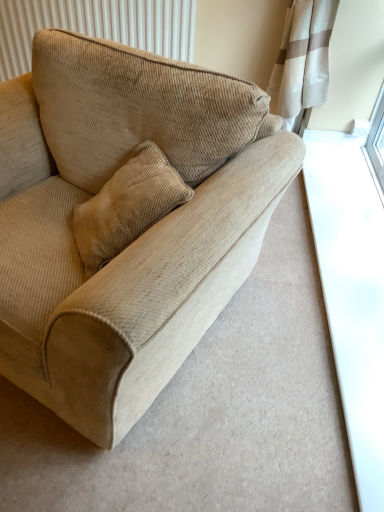
Question: Is beige corduroy radiator at upper left a part of beige corduroy couch at center?

Choices:
 (A) no
 (B) yes

Answer: (A)

Question: Can you confirm if beige corduroy couch at center is wider than beige corduroy radiator at upper left?

Choices:
 (A) yes
 (B) no

Answer: (A)

Question: Does beige corduroy couch at center have a smaller size compared to beige corduroy radiator at upper left?

Choices:
 (A) no
 (B) yes

Answer: (A)

Question: Is there a large distance between beige corduroy couch at center and beige corduroy radiator at upper left?

Choices:
 (A) yes
 (B) no

Answer: (A)

Question: From a real-world perspective, is beige corduroy couch at center below beige corduroy radiator at upper left?

Choices:
 (A) yes
 (B) no

Answer: (A)

Question: Is beige corduroy couch at center directly adjacent to beige corduroy radiator at upper left?

Choices:
 (A) no
 (B) yes

Answer: (A)

Question: Considering the relative sizes of beige corduroy radiator at upper left and beige corduroy couch at center in the image provided, is beige corduroy radiator at upper left wider than beige corduroy couch at center?

Choices:
 (A) no
 (B) yes

Answer: (A)

Question: From a real-world perspective, is beige corduroy radiator at upper left physically above beige corduroy couch at center?

Choices:
 (A) no
 (B) yes

Answer: (B)

Question: Is beige corduroy radiator at upper left shorter than beige corduroy couch at center?

Choices:
 (A) no
 (B) yes

Answer: (B)

Question: From the image's perspective, is beige corduroy radiator at upper left located beneath beige corduroy couch at center?

Choices:
 (A) no
 (B) yes

Answer: (A)

Question: Considering the relative positions of beige corduroy radiator at upper left and beige corduroy couch at center in the image provided, is beige corduroy radiator at upper left behind beige corduroy couch at center?

Choices:
 (A) yes
 (B) no

Answer: (A)

Question: Is beige corduroy radiator at upper left smaller than beige corduroy couch at center?

Choices:
 (A) yes
 (B) no

Answer: (A)

Question: From a real-world perspective, relative to beige corduroy radiator at upper left, is beige corduroy couch at center vertically above or below?

Choices:
 (A) above
 (B) below

Answer: (B)